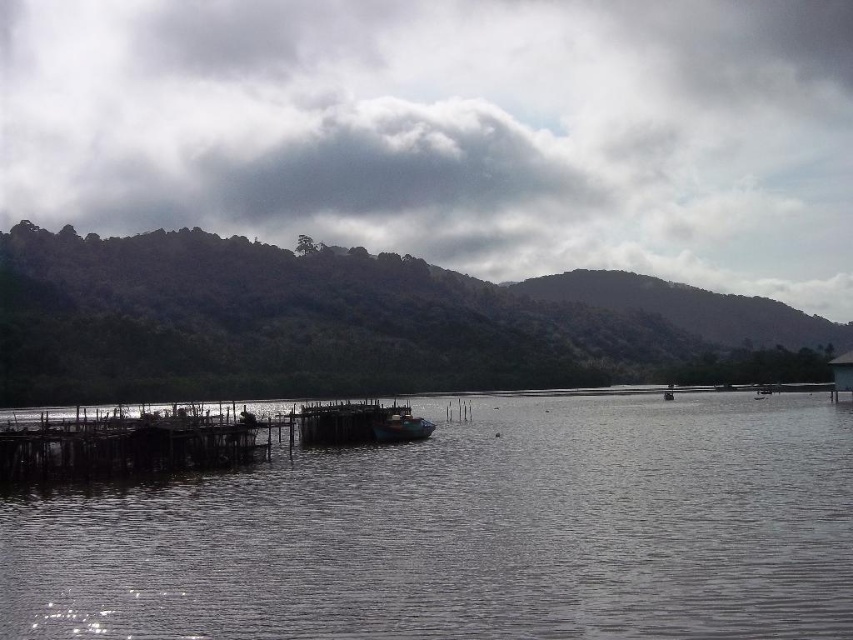
Question: Which object is closer to the camera taking this photo?

Choices:
 (A) wooden dock at lower left
 (B) green forested mountain at left
 (C) clear water at lower left

Answer: (C)

Question: Is the position of clear water at lower left more distant than that of green forested mountain at left?

Choices:
 (A) no
 (B) yes

Answer: (A)

Question: Which object is the farthest from the cloudy sky at upper center?

Choices:
 (A) wooden dock at lower left
 (B) wooden dock at center
 (C) wooden boat at center
 (D) clear water at lower left

Answer: (B)

Question: Can you confirm if wooden dock at lower left is positioned to the right of wooden boat at center?

Choices:
 (A) yes
 (B) no

Answer: (B)

Question: Is cloudy sky at upper center wider than wooden dock at lower left?

Choices:
 (A) no
 (B) yes

Answer: (B)

Question: Among these points, which one is nearest to the camera?

Choices:
 (A) (349, 225)
 (B) (349, 436)

Answer: (B)